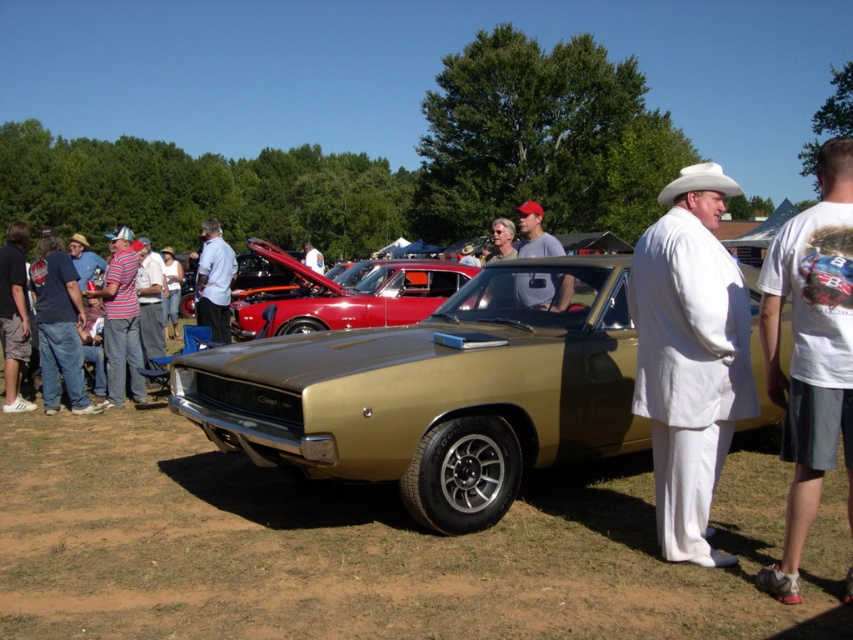
Does white cotton suit at center have a greater height compared to white felt cowboy hat at upper right?

In fact, white cotton suit at center may be shorter than white felt cowboy hat at upper right.

Where is `white cotton suit at center`? white cotton suit at center is located at coordinates (689, 356).

Describe the element at coordinates (689, 356) in the screenshot. I see `white cotton suit at center` at that location.

Find the location of a particular element. Image resolution: width=853 pixels, height=640 pixels. white cotton suit at center is located at coordinates (689, 356).

Between white cotton suit at center and white cotton t-shirt at center, which one appears on the left side from the viewer's perspective?

white cotton suit at center

Is white cotton suit at center further to the viewer compared to white cotton t-shirt at center?

That is True.

Locate an element on the screen. This screenshot has height=640, width=853. white cotton suit at center is located at coordinates (689, 356).

Who is more distant from viewer, (711, 429) or (198, 307)?

Point (198, 307)

Is white cotton suit at center below light blue shirt at center?

Yes, white cotton suit at center is below light blue shirt at center.

Which is behind, point (729, 413) or point (218, 275)?

Point (218, 275)

Locate an element on the screen. The image size is (853, 640). white cotton suit at center is located at coordinates (689, 356).